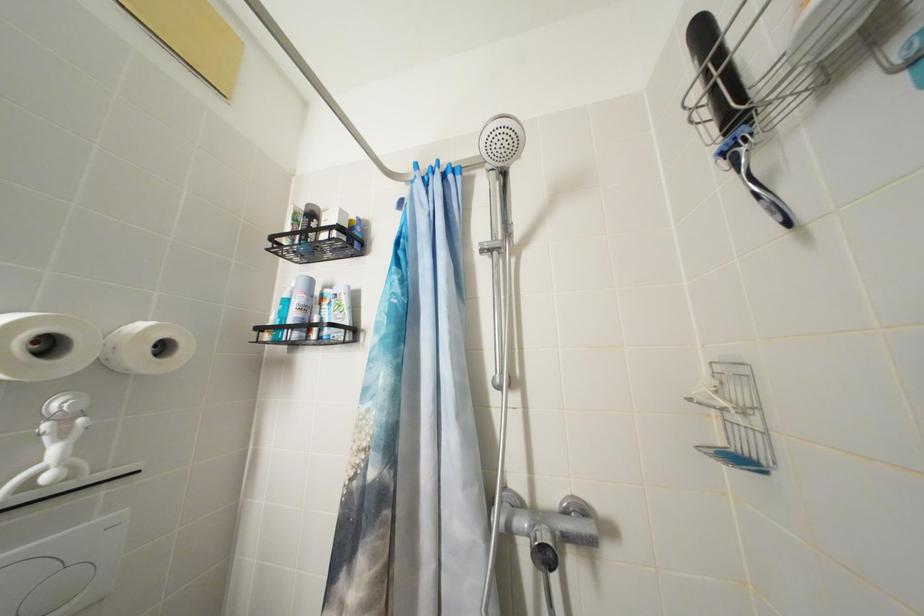
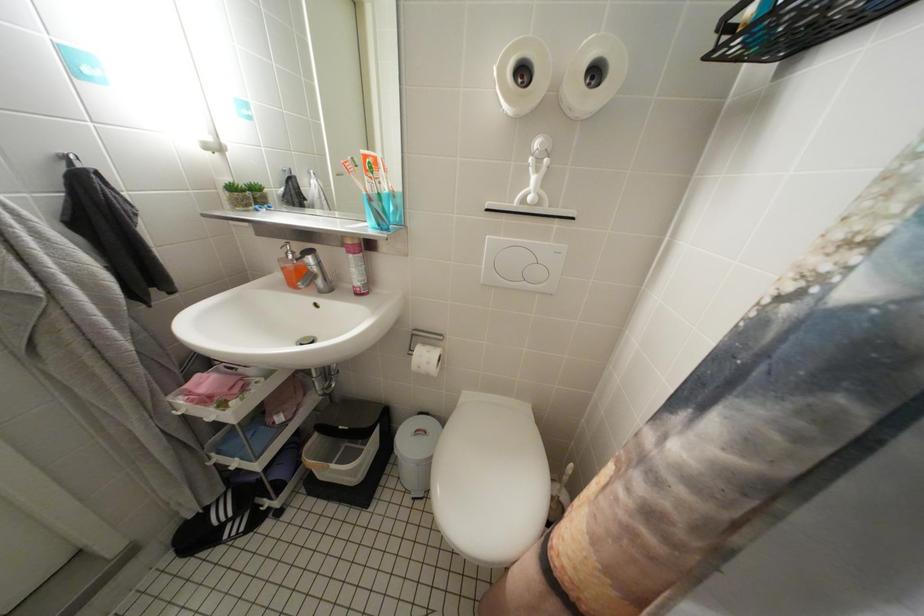
The first image is from the beginning of the video and the second image is from the end. How did the camera likely rotate when shooting the video?

The rotation direction of the camera is left-down.